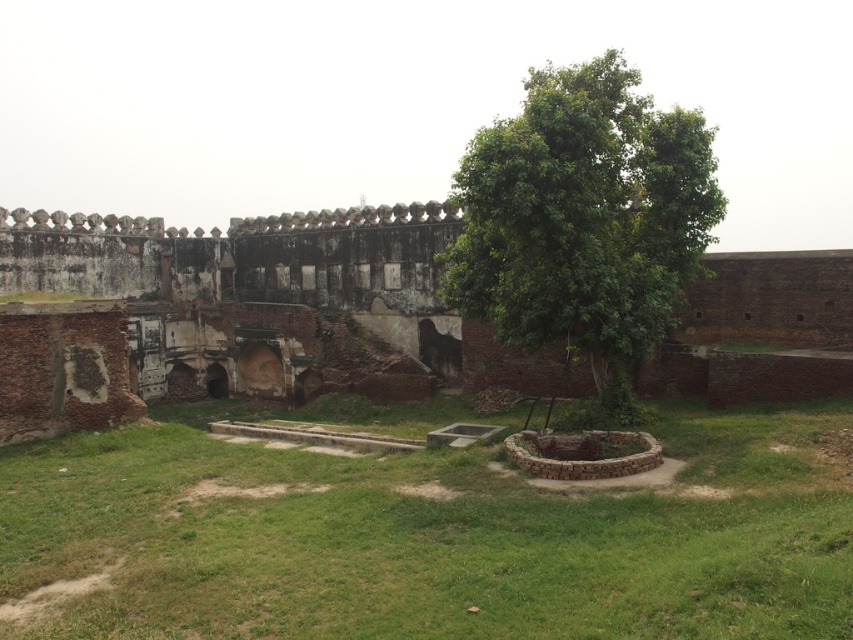
You are standing in the historical fort and want to find a spot to rest where you can enjoy shade. You see the green grass at center and the green leafy tree at center. Which location would provide shade?

The green leafy tree at center provides shade, so you should rest under the green grass at center since it is positioned under the tree.

You are an architect examining the historical site. You notice the weathered brick palace at center and the green leafy tree at center. Which structure is located below the other?

The weathered brick palace at center is positioned under the green leafy tree at center, so the palace is below the tree.

You are standing in the middle of the grassy area and want to approach the weathered brick palace at center. Which direction should you move to reach it from the green grass at center?

Since the green grass at center is positioned on the right side of the weathered brick palace at center, you should move to the left to reach the palace from the grass.